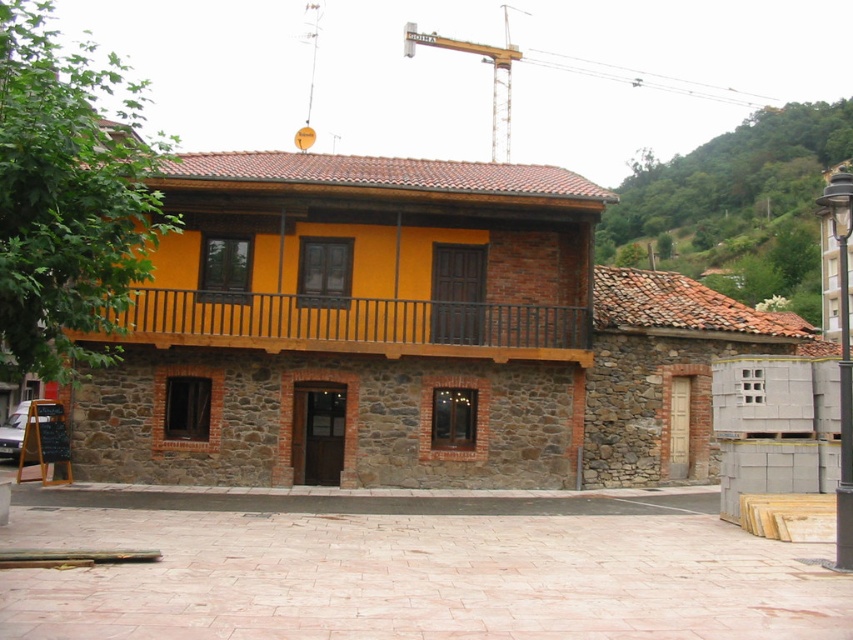
You are standing in front of a rustic two story building. There is a point at coordinates point (216,298). Can you reach that point without moving closer to the building?

The point (216,298) is 19.46 meters away from the viewer, so you cannot reach it without moving closer to the building.

You are standing in front of the two story building and want to take a photo of the wooden at upper center and the green leafy hillside at upper right. Which object should you pan your camera to the right to include in the frame first?

You should pan your camera to the right to include the green leafy hillside at upper right first because it is located to the right of the wooden at upper center.

Looking at this image, you are a drone operator trying to capture a photo of the green leafy hillside at upper right. The drone is currently at the point with coordinates point (737,204). Is this the correct location to take the photo?

Yes, the point (737,204) indicates the green leafy hillside at upper right, so the drone is at the correct location to take the photo.